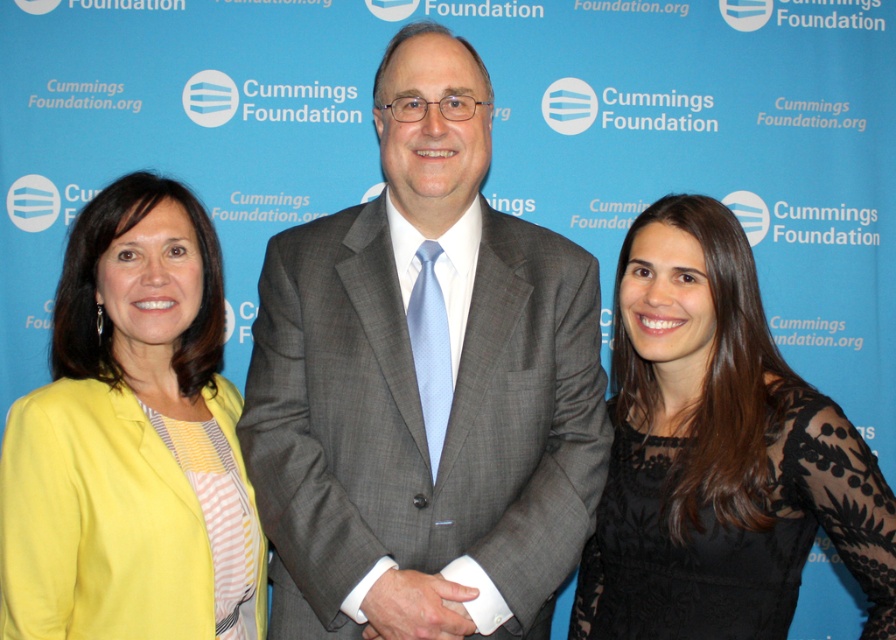
Question: Is gray suit at center behind yellow fabric jacket at left?

Choices:
 (A) yes
 (B) no

Answer: (A)

Question: Which object appears closest to the camera in this image?

Choices:
 (A) gray suit at center
 (B) black lace dress at center
 (C) white smooth shirt at center
 (D) yellow fabric jacket at left

Answer: (C)

Question: Estimate the real-world distances between objects in this image. Which object is farther from the white smooth shirt at center?

Choices:
 (A) gray suit at center
 (B) black lace dress at center
 (C) yellow fabric jacket at left

Answer: (B)

Question: Does black lace dress at center have a larger size compared to yellow fabric jacket at left?

Choices:
 (A) yes
 (B) no

Answer: (A)

Question: Can you confirm if gray suit at center is positioned below white smooth shirt at center?

Choices:
 (A) yes
 (B) no

Answer: (B)

Question: Which point is closer to the camera taking this photo?

Choices:
 (A) (780, 436)
 (B) (145, 323)
 (C) (592, 410)

Answer: (A)